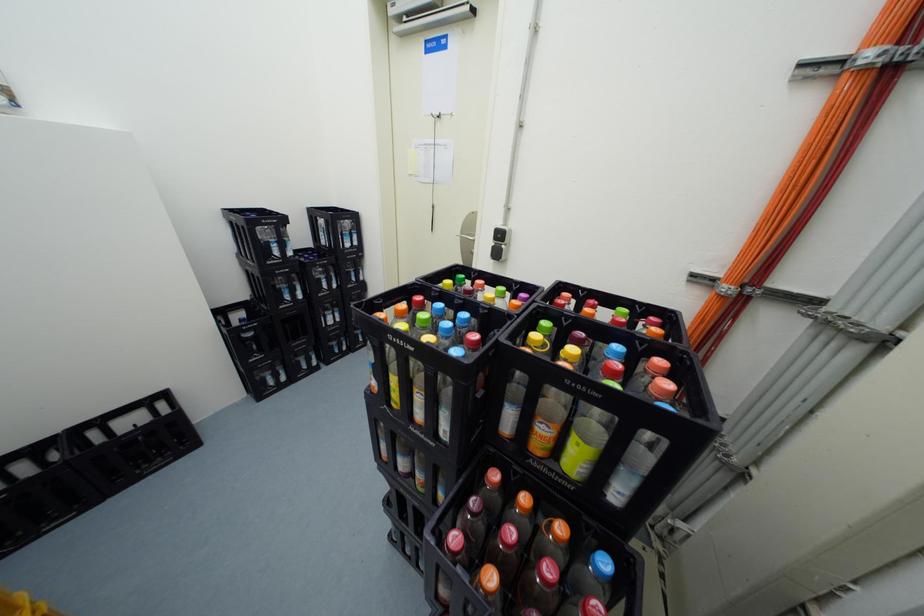
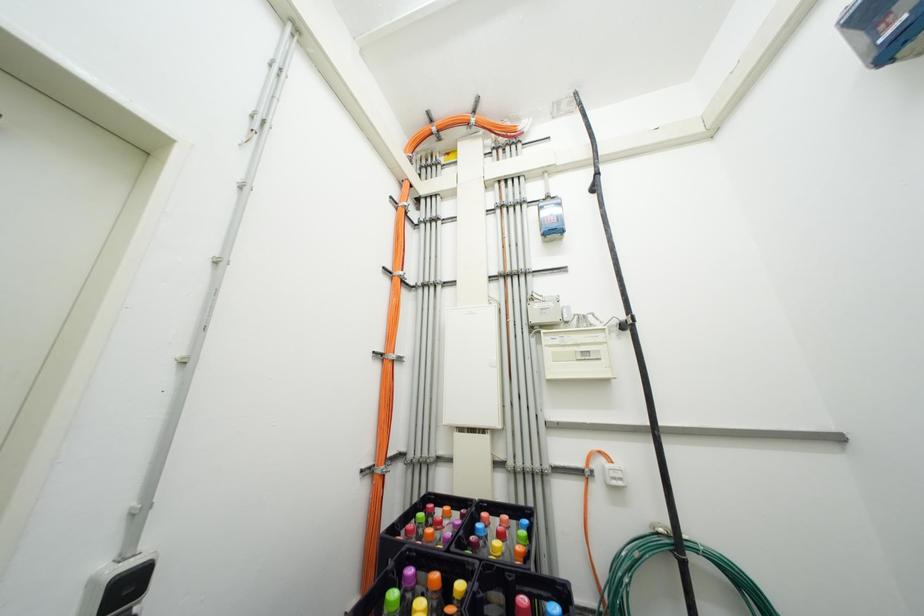
Question: The camera is either moving clockwise (left) or counter-clockwise (right) around the object. The first image is from the beginning of the video and the second image is from the end. Is the camera moving left or right when shooting the video?

Choices:
 (A) Left
 (B) Right

Answer: (A)